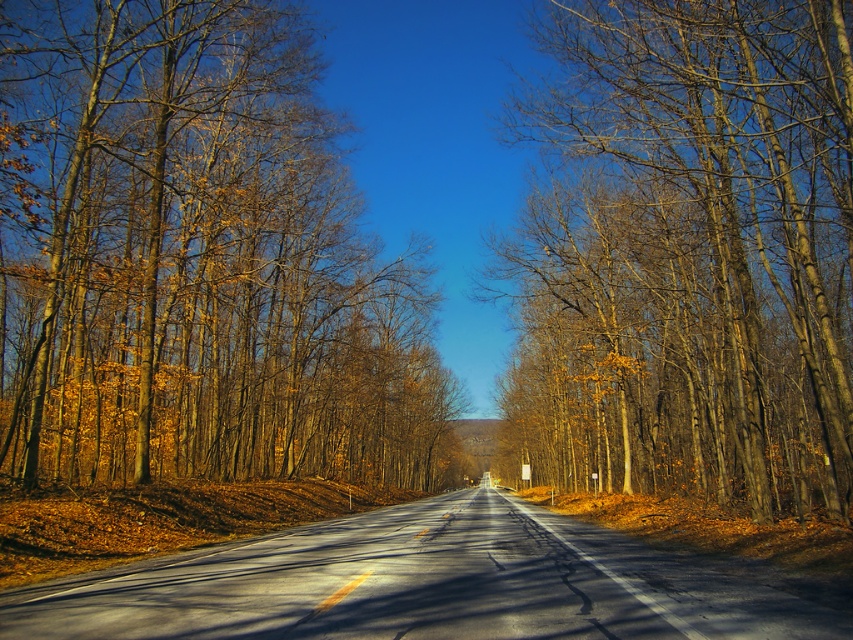
Is brown bark tree at center positioned in front of brown wood tree at center?

No, it is not.

Who is more distant from viewer, (x=38, y=273) or (x=764, y=480)?

Positioned behind is point (x=38, y=273).

Locate an element on the screen. This screenshot has width=853, height=640. brown bark tree at center is located at coordinates (195, 259).